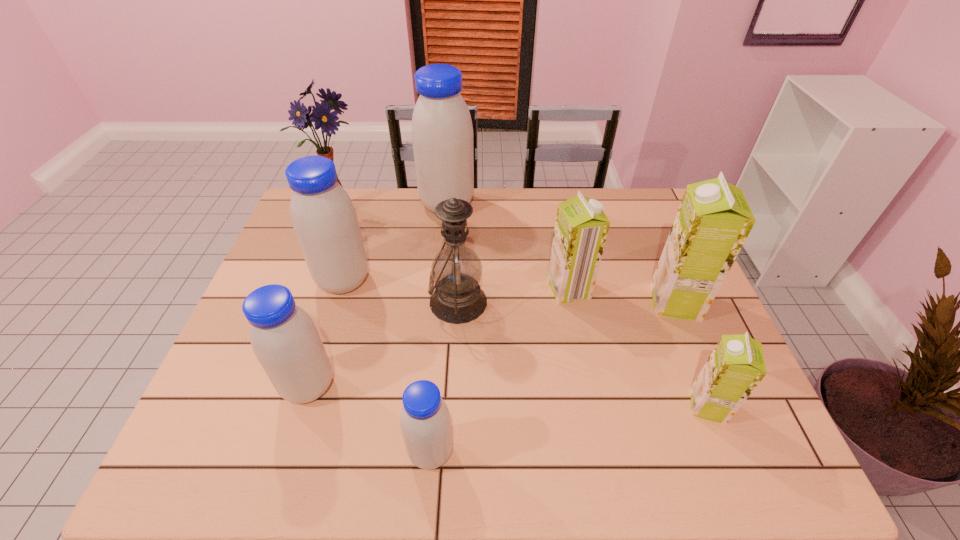
What are the coordinates of `empty space that is in between the smallest green soya milk and the purple flower arrangement` in the screenshot? It's located at (523, 309).

Where is `empty space between the biggest blue soya milk and the second farthest blue soya milk`? The width and height of the screenshot is (960, 540). empty space between the biggest blue soya milk and the second farthest blue soya milk is located at coordinates (396, 243).

Where is `empty space between the leftmost green soya milk and the nearest blue soya milk`? The image size is (960, 540). empty space between the leftmost green soya milk and the nearest blue soya milk is located at coordinates (500, 370).

Where is `free space between the oil lamp and the nearest object`? free space between the oil lamp and the nearest object is located at coordinates (444, 377).

Where is `free space between the third nearest blue soya milk and the biggest blue soya milk`? free space between the third nearest blue soya milk and the biggest blue soya milk is located at coordinates (396, 243).

You are a GUI agent. You are given a task and a screenshot of the screen. Output one action in this format:
    pyautogui.click(x=<x>, y=<y>)
    Task: Click on the vacant area that lies between the biggest green soya milk and the nearest object
    This screenshot has width=960, height=540.
    Given the screenshot: What is the action you would take?
    pyautogui.click(x=553, y=377)

The width and height of the screenshot is (960, 540). Find the location of `free space between the smallest blue soya milk and the biggest green soya milk`. free space between the smallest blue soya milk and the biggest green soya milk is located at coordinates (553, 377).

At what (x,y) coordinates should I click in order to perform the action: click on free spot between the nearest soya milk and the oil lamp. Please return your answer as a coordinate pair (x, y). Looking at the image, I should click on (444, 377).

Where is `free spot between the biggest green soya milk and the nearest green soya milk`? free spot between the biggest green soya milk and the nearest green soya milk is located at coordinates (691, 354).

Where is `free space between the second nearest blue soya milk and the oil lamp`? The height and width of the screenshot is (540, 960). free space between the second nearest blue soya milk and the oil lamp is located at coordinates (384, 344).